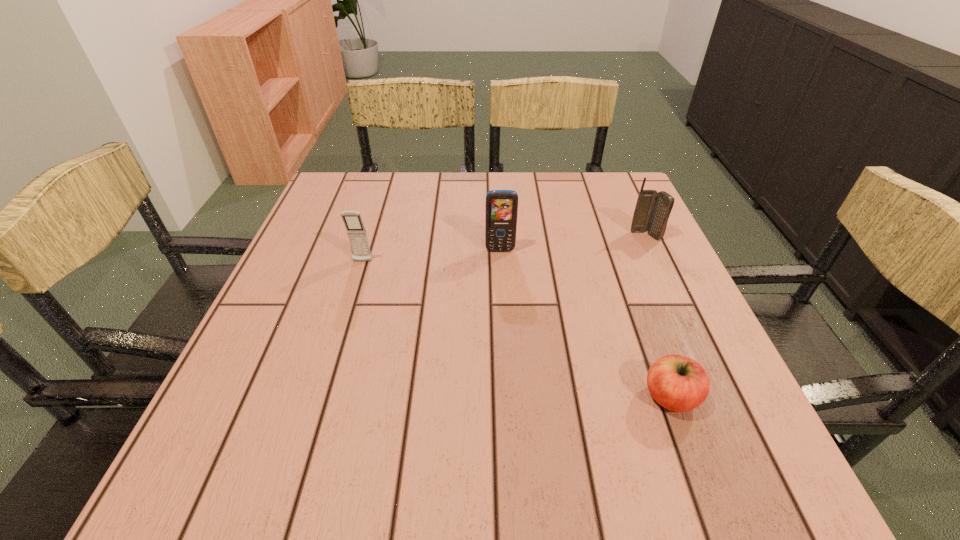
The image size is (960, 540). Identify the location of free space located on the front-facing side of the third farthest object. click(x=329, y=368).

Locate an element on the screen. The image size is (960, 540). free point located 0.090m on the back of the shortest object is located at coordinates (648, 336).

At what (x,y) coordinates should I click in order to perform the action: click on object that is at the left edge. Please return your answer as a coordinate pair (x, y). Looking at the image, I should click on (356, 231).

Identify the location of cellular telephone situated at the right edge. The image size is (960, 540). (652, 210).

Where is `apple that is at the right edge`? The width and height of the screenshot is (960, 540). apple that is at the right edge is located at coordinates (678, 383).

At what (x,y) coordinates should I click in order to perform the action: click on vacant space at the far edge. Please return your answer as a coordinate pair (x, y). The width and height of the screenshot is (960, 540). Looking at the image, I should click on (440, 188).

The image size is (960, 540). I want to click on blank space at the near edge, so click(470, 456).

Find the location of a particular element. The width and height of the screenshot is (960, 540). blank space at the left edge of the desktop is located at coordinates (335, 221).

Image resolution: width=960 pixels, height=540 pixels. In order to click on vacant space at the right edge in this screenshot , I will do `click(636, 365)`.

Where is `free space at the far left corner of the desktop`? This screenshot has height=540, width=960. free space at the far left corner of the desktop is located at coordinates (345, 174).